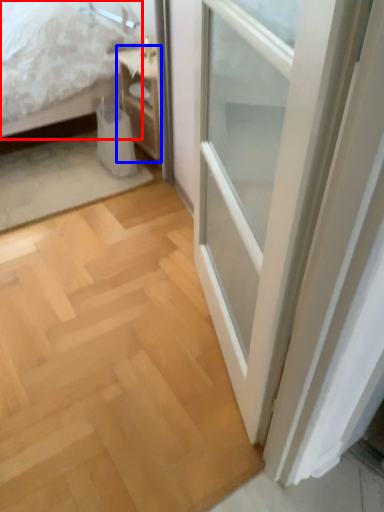
Question: Which object is closer to the camera taking this photo, bed (highlighted by a red box) or nightstand (highlighted by a blue box)?

Choices:
 (A) bed
 (B) nightstand

Answer: (A)